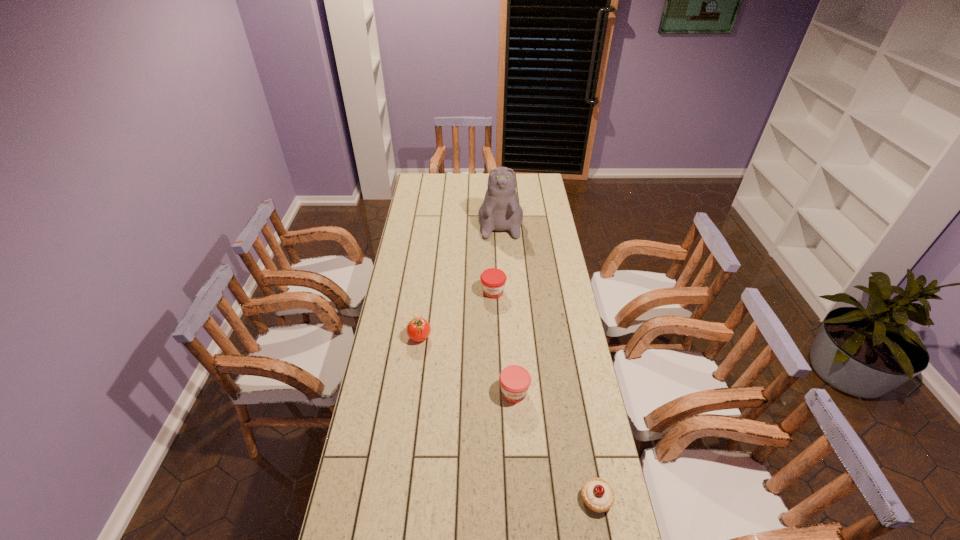
Find the location of a particular element. The width and height of the screenshot is (960, 540). the tallest object is located at coordinates (500, 210).

Find the location of a particular element. the farthest object is located at coordinates (500, 210).

This screenshot has height=540, width=960. In order to click on the farther jam in this screenshot , I will do `click(493, 280)`.

This screenshot has width=960, height=540. What are the coordinates of `the third nearest object` in the screenshot? It's located at (418, 329).

The width and height of the screenshot is (960, 540). What are the coordinates of `tomato` in the screenshot? It's located at click(418, 329).

The width and height of the screenshot is (960, 540). What are the coordinates of `the second nearest object` in the screenshot? It's located at (515, 380).

The height and width of the screenshot is (540, 960). In order to click on the shortest object in this screenshot , I will do `click(597, 494)`.

Where is `pastry`? The width and height of the screenshot is (960, 540). pastry is located at coordinates (597, 494).

Where is `vacant space situated 0.170m on the face of the tallest object`? The width and height of the screenshot is (960, 540). vacant space situated 0.170m on the face of the tallest object is located at coordinates tap(502, 262).

This screenshot has height=540, width=960. What are the coordinates of `vacant area situated on the label side of the fourth nearest object` in the screenshot? It's located at (494, 321).